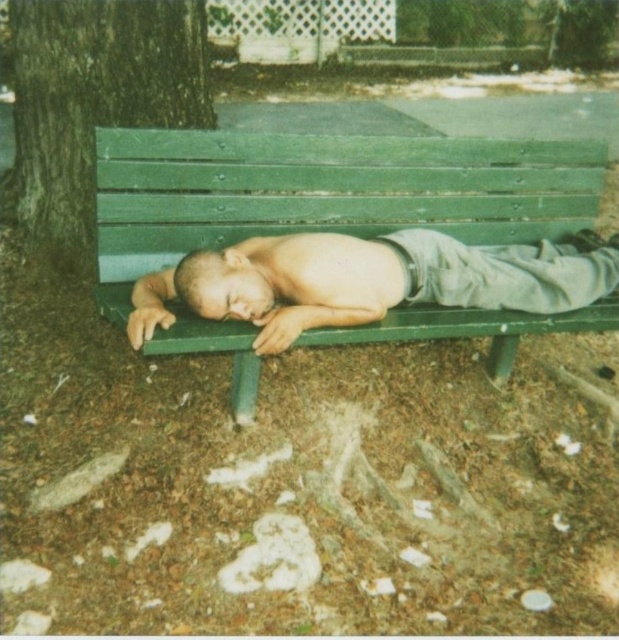
Is green rough bark at left thinner than smooth skin man at center?

Yes.

Is the position of green rough bark at left more distant than that of smooth skin man at center?

Yes.

The width and height of the screenshot is (619, 640). I want to click on green rough bark at left, so click(93, 100).

This screenshot has width=619, height=640. I want to click on green rough bark at left, so click(93, 100).

Consider the image. Does green painted wood bench at center appear on the right side of smooth skin man at center?

No, green painted wood bench at center is not to the right of smooth skin man at center.

Which is more to the right, green painted wood bench at center or smooth skin man at center?

Positioned to the right is smooth skin man at center.

The height and width of the screenshot is (640, 619). Describe the element at coordinates (324, 192) in the screenshot. I see `green painted wood bench at center` at that location.

What are the coordinates of `green painted wood bench at center` in the screenshot? It's located at (324, 192).

Which is in front, point (171, 186) or point (41, 150)?

Point (171, 186) is in front.

What do you see at coordinates (324, 192) in the screenshot? I see `green painted wood bench at center` at bounding box center [324, 192].

Is point (527, 177) in front of point (12, 45)?

Yes, point (527, 177) is in front of point (12, 45).

Find the location of `green painted wood bench at center`. green painted wood bench at center is located at coordinates (324, 192).